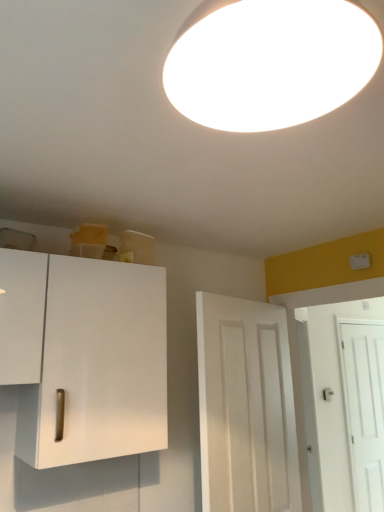
I want to click on white matte door at right, which is counted as the first door, starting from the right, so click(364, 407).

You are a GUI agent. You are given a task and a screenshot of the screen. Output one action in this format:
    pyautogui.click(x=<x>, y=<y>)
    Task: Click on the white smooth door at center, the 1th door in the front-to-back sequence
    
    Given the screenshot: What is the action you would take?
    pyautogui.click(x=246, y=407)

Locate an element on the screen. This screenshot has height=512, width=384. white matte light fixture at upper center is located at coordinates (269, 62).

Measure the distance between white matte light fixture at upper center and camera.

white matte light fixture at upper center is 20.75 inches from camera.

Where is `white matte door at right, the 3th door positioned from the left`? This screenshot has height=512, width=384. white matte door at right, the 3th door positioned from the left is located at coordinates (364, 407).

Is white matte cabinet at left directly adjacent to white smooth door at center, the 1th door in the front-to-back sequence?

white matte cabinet at left and white smooth door at center, the 1th door in the front-to-back sequence, are not in contact.

In the scene shown: Considering the sizes of objects white matte cabinet at left and white smooth door at center, which is the 3th door in back-to-front order, in the image provided, who is shorter, white matte cabinet at left or white smooth door at center, which is the 3th door in back-to-front order,?

With less height is white matte cabinet at left.

Which object is further away from the camera taking this photo, white matte cabinet at left or white smooth door at center, placed as the 3th door when sorted from right to left?

white smooth door at center, placed as the 3th door when sorted from right to left, is behind.

Is white matte cabinet at left not inside white smooth door at center, the 1th door in the front-to-back sequence?

Indeed, white matte cabinet at left is completely outside white smooth door at center, the 1th door in the front-to-back sequence.

From a real-world perspective, which object stands above the other?

In real-world perspective, white matte door at right, which ranks as the second door in back-to-front order, is above.

Which is correct: white matte door at right, which ranks as the second door in back-to-front order, is inside white matte door at right, the third door in the front-to-back sequence, or outside of it?

white matte door at right, which ranks as the second door in back-to-front order, is located beyond the bounds of white matte door at right, the third door in the front-to-back sequence.

Is white matte door at right, which ranks as the 2th door in left-to-right order, directly adjacent to white matte door at right, the 3th door positioned from the left?

There is a gap between white matte door at right, which ranks as the 2th door in left-to-right order, and white matte door at right, the 3th door positioned from the left.

Considering the positions of objects white matte door at right, the 2th door when ordered from front to back, and white matte door at right, which is the 1th door in back-to-front order, in the image provided, who is more to the right, white matte door at right, the 2th door when ordered from front to back, or white matte door at right, which is the 1th door in back-to-front order,?

white matte door at right, which is the 1th door in back-to-front order.

Is white matte door at right, the third door in the front-to-back sequence, oriented towards white matte light fixture at upper center?

No, white matte door at right, the third door in the front-to-back sequence, does not turn towards white matte light fixture at upper center.

From a real-world perspective, count 3rd doors downward from the white matte light fixture at upper center and point to it. Please provide its 2D coordinates.

[(364, 407)]

From a real-world perspective, between white matte door at right, which is counted as the first door, starting from the right, and white matte light fixture at upper center, who is vertically higher?

From a 3D spatial view, white matte light fixture at upper center is above.

Which of these two, white matte door at right, which ranks as the second door in back-to-front order, or white matte light fixture at upper center, is smaller?

white matte light fixture at upper center.

Looking at this image, could you measure the distance between white matte door at right, the 2th door viewed from the right, and white matte light fixture at upper center?

white matte door at right, the 2th door viewed from the right, is 9.58 feet from white matte light fixture at upper center.

Identify the location of lamp located on the left of white matte door at right, the 2th door viewed from the right. (269, 62).

From the image's perspective, is white matte door at right, which ranks as the second door in back-to-front order, above white matte light fixture at upper center?

No, from the image's perspective, white matte door at right, which ranks as the second door in back-to-front order, is not over white matte light fixture at upper center.

Between white smooth door at center, which is the 3th door in back-to-front order, and white matte light fixture at upper center, which one appears on the right side from the viewer's perspective?

Positioned to the right is white smooth door at center, which is the 3th door in back-to-front order.

From the image's perspective, does white smooth door at center, placed as the first door when sorted from left to right, appear higher than white matte light fixture at upper center?

Actually, white smooth door at center, placed as the first door when sorted from left to right, appears below white matte light fixture at upper center in the image.

Would you consider white smooth door at center, which is the 3th door in back-to-front order, to be distant from white matte light fixture at upper center?

Yes.

Can you confirm if white smooth door at center, placed as the first door when sorted from left to right, is shorter than white matte light fixture at upper center?

No, white smooth door at center, placed as the first door when sorted from left to right, is not shorter than white matte light fixture at upper center.

Is the depth of white matte cabinet at left greater than that of white matte light fixture at upper center?

Yes, white matte cabinet at left is further from the viewer.

Is white matte cabinet at left smaller than white matte light fixture at upper center?

No.

From the image's perspective, is white matte cabinet at left located above white matte light fixture at upper center?

No, from the image's perspective, white matte cabinet at left is not over white matte light fixture at upper center.

Is white matte cabinet at left situated inside white matte light fixture at upper center or outside?

The correct answer is: outside.

Where is `cabinetry lying in front of the white matte door at right, which is counted as the first door, starting from the right`? cabinetry lying in front of the white matte door at right, which is counted as the first door, starting from the right is located at coordinates (84, 356).

Is white matte cabinet at left beside white matte door at right, which is the 1th door in back-to-front order?

No, white matte cabinet at left is not beside white matte door at right, which is the 1th door in back-to-front order.

Between white matte cabinet at left and white matte door at right, which is counted as the first door, starting from the right, which one has larger width?

white matte cabinet at left.

I want to click on cabinetry above the white smooth door at center, which is the 3th door in back-to-front order (from a real-world perspective), so click(84, 356).

From a real-world perspective, which door is the 2nd one underneath the white matte door at right, which ranks as the second door in back-to-front order? Please provide its 2D coordinates.

[(364, 407)]

Estimate the real-world distances between objects in this image. Which object is further from white matte light fixture at upper center, white smooth door at center, which is the 3th door in back-to-front order, or white matte door at right, which is the 1th door in back-to-front order?

white matte door at right, which is the 1th door in back-to-front order, lies further to white matte light fixture at upper center than the other object.

Which object lies further to the anchor point white matte door at right, the 3th door positioned from the left, white matte cabinet at left or white matte door at right, the 2th door viewed from the right?

white matte cabinet at left lies further to white matte door at right, the 3th door positioned from the left, than the other object.

Which object lies further to the anchor point white smooth door at center, the 1th door in the front-to-back sequence, white matte cabinet at left or white matte light fixture at upper center?

white matte light fixture at upper center lies further to white smooth door at center, the 1th door in the front-to-back sequence, than the other object.

Estimate the real-world distances between objects in this image. Which object is further from white matte door at right, which ranks as the 2th door in left-to-right order, white matte door at right, which is counted as the first door, starting from the right, or white matte light fixture at upper center?

white matte light fixture at upper center is positioned further to the anchor white matte door at right, which ranks as the 2th door in left-to-right order.

Looking at the image, which one is located closer to white matte light fixture at upper center, white matte door at right, the 3th door positioned from the left, or white matte door at right, which ranks as the 2th door in left-to-right order?

white matte door at right, which ranks as the 2th door in left-to-right order, is closer to white matte light fixture at upper center.

Estimate the real-world distances between objects in this image. Which object is closer to white matte door at right, the 2th door viewed from the right, white matte cabinet at left or white matte door at right, which is the 1th door in back-to-front order?

white matte door at right, which is the 1th door in back-to-front order, is closer to white matte door at right, the 2th door viewed from the right.

Estimate the real-world distances between objects in this image. Which object is further from white matte door at right, the 2th door viewed from the right, white matte cabinet at left or white matte light fixture at upper center?

white matte light fixture at upper center.

Based on their spatial positions, is white matte door at right, which is counted as the first door, starting from the right, or white matte cabinet at left further from white matte light fixture at upper center?

white matte door at right, which is counted as the first door, starting from the right.

Where is `cabinetry between white matte light fixture at upper center and white matte door at right, the 2th door viewed from the right, in the front-back direction`? cabinetry between white matte light fixture at upper center and white matte door at right, the 2th door viewed from the right, in the front-back direction is located at coordinates (x=84, y=356).

At what (x,y) coordinates should I click in order to perform the action: click on cabinetry between white matte light fixture at upper center and white smooth door at center, placed as the 3th door when sorted from right to left, from front to back. Please return your answer as a coordinate pair (x, y). Looking at the image, I should click on (84, 356).

The image size is (384, 512). I want to click on cabinetry between white matte light fixture at upper center and white matte door at right, which is counted as the first door, starting from the right, in the front-back direction, so click(84, 356).

Locate an element on the screen. door situated between white matte cabinet at left and white matte door at right, the 2th door viewed from the right, from left to right is located at coordinates (246, 407).